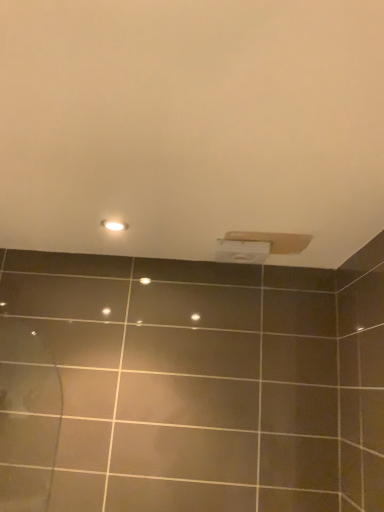
In order to click on white matte toilet paper at upper center in this screenshot , I will do `click(242, 251)`.

In order to face white matte toilet paper at upper center, should I rotate leftwards or rightwards?

Rotate right and turn 6.879 degrees.

What do you see at coordinates (242, 251) in the screenshot? I see `white matte toilet paper at upper center` at bounding box center [242, 251].

What do you see at coordinates (114, 225) in the screenshot? I see `matte white light fixture at upper center` at bounding box center [114, 225].

I want to click on matte white light fixture at upper center, so click(114, 225).

Where is `white matte toilet paper at upper center`? The image size is (384, 512). white matte toilet paper at upper center is located at coordinates (242, 251).

In the scene shown: Which is more to the right, matte white light fixture at upper center or white matte toilet paper at upper center?

white matte toilet paper at upper center is more to the right.

Is matte white light fixture at upper center in front of or behind white matte toilet paper at upper center in the image?

matte white light fixture at upper center is positioned closer to the viewer than white matte toilet paper at upper center.

Which is in front, point (127, 228) or point (258, 254)?

The point (127, 228) is closer to the camera.

From the image's perspective, does matte white light fixture at upper center appear lower than white matte toilet paper at upper center?

No, from the image's perspective, matte white light fixture at upper center is not beneath white matte toilet paper at upper center.

From a real-world perspective, who is located higher, matte white light fixture at upper center or white matte toilet paper at upper center?

matte white light fixture at upper center, from a real-world perspective.

Considering the relative sizes of matte white light fixture at upper center and white matte toilet paper at upper center in the image provided, is matte white light fixture at upper center wider than white matte toilet paper at upper center?

No, matte white light fixture at upper center is not wider than white matte toilet paper at upper center.

Between matte white light fixture at upper center and white matte toilet paper at upper center, which one has less height?

With less height is matte white light fixture at upper center.

Between matte white light fixture at upper center and white matte toilet paper at upper center, which one has larger size?

white matte toilet paper at upper center is bigger.

Is matte white light fixture at upper center surrounding white matte toilet paper at upper center?

Actually, white matte toilet paper at upper center is outside matte white light fixture at upper center.

Is matte white light fixture at upper center far from white matte toilet paper at upper center?

No, matte white light fixture at upper center is in close proximity to white matte toilet paper at upper center.

Does matte white light fixture at upper center turn towards white matte toilet paper at upper center?

No, matte white light fixture at upper center is not aimed at white matte toilet paper at upper center.

How many degrees apart are the facing directions of matte white light fixture at upper center and white matte toilet paper at upper center?

They differ by 1.63 degrees in their facing directions.

How distant is matte white light fixture at upper center from white matte toilet paper at upper center?

Result: matte white light fixture at upper center and white matte toilet paper at upper center are 40.30 centimeters apart from each other.

Image resolution: width=384 pixels, height=512 pixels. There is a white matte toilet paper at upper center. What are the coordinates of `light fixture above it (from a real-world perspective)` in the screenshot? It's located at (114, 225).

Is white matte toilet paper at upper center to the left or to the right of matte white light fixture at upper center in the image?

Clearly, white matte toilet paper at upper center is on the right of matte white light fixture at upper center in the image.

Is white matte toilet paper at upper center in front of or behind matte white light fixture at upper center in the image?

white matte toilet paper at upper center is behind matte white light fixture at upper center.

Is point (223, 249) positioned in front of point (124, 229)?

No, it is behind (124, 229).

From the image's perspective, between white matte toilet paper at upper center and matte white light fixture at upper center, which one is located above?

matte white light fixture at upper center, from the image's perspective.

From a real-world perspective, which is physically below, white matte toilet paper at upper center or matte white light fixture at upper center?

white matte toilet paper at upper center.

Which object is wider, white matte toilet paper at upper center or matte white light fixture at upper center?

Wider between the two is white matte toilet paper at upper center.

Does white matte toilet paper at upper center have a greater height compared to matte white light fixture at upper center?

Yes.

Is white matte toilet paper at upper center smaller than matte white light fixture at upper center?

Incorrect, white matte toilet paper at upper center is not smaller in size than matte white light fixture at upper center.

Does white matte toilet paper at upper center contain matte white light fixture at upper center?

Definitely not — matte white light fixture at upper center is not inside white matte toilet paper at upper center.

Are white matte toilet paper at upper center and matte white light fixture at upper center beside each other?

white matte toilet paper at upper center and matte white light fixture at upper center are clearly separated.

Is white matte toilet paper at upper center looking in the opposite direction of matte white light fixture at upper center?

white matte toilet paper at upper center is not turned away from matte white light fixture at upper center.

How different are the orientations of white matte toilet paper at upper center and matte white light fixture at upper center in degrees?

There is a 1.63-degree angle between the facing directions of white matte toilet paper at upper center and matte white light fixture at upper center.

Where is `toilet paper below the matte white light fixture at upper center (from a real-world perspective)`? The width and height of the screenshot is (384, 512). toilet paper below the matte white light fixture at upper center (from a real-world perspective) is located at coordinates (242, 251).

You are a GUI agent. You are given a task and a screenshot of the screen. Output one action in this format:
    pyautogui.click(x=<x>, y=<y>)
    Task: Click on the light fixture in front of the white matte toilet paper at upper center
    The height and width of the screenshot is (512, 384).
    Given the screenshot: What is the action you would take?
    pyautogui.click(x=114, y=225)

This screenshot has height=512, width=384. What are the coordinates of `light fixture lying on the left of white matte toilet paper at upper center` in the screenshot? It's located at (114, 225).